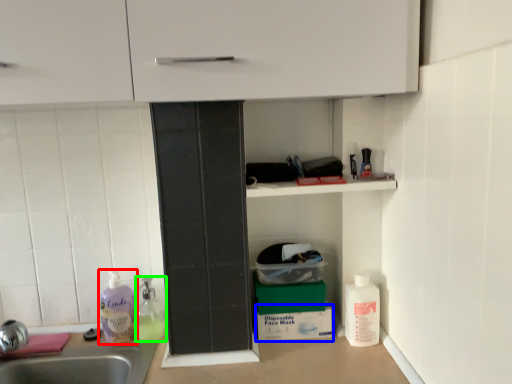
Question: Which object is positioned closest to cleaning product (highlighted by a red box)? Select from cardboard box (highlighted by a blue box) and cleaning product (highlighted by a green box).

Choices:
 (A) cardboard box
 (B) cleaning product

Answer: (B)